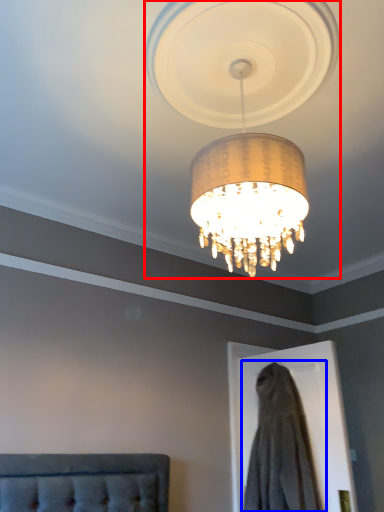
Question: Which point is closer to the camera, lamp (highlighted by a red box) or dress (highlighted by a blue box)?

Choices:
 (A) lamp
 (B) dress

Answer: (A)